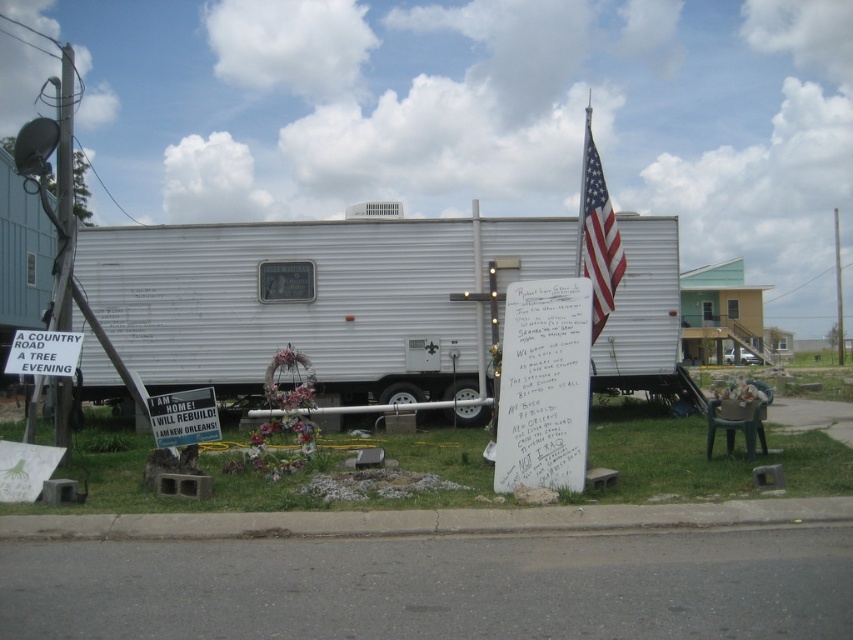
Is the position of white paper at center more distant than that of american flag at center?

No, white paper at center is closer to the viewer.

Between white paper at center and american flag at center, which one appears on the left side from the viewer's perspective?

white paper at center is more to the left.

Is point (576, 380) positioned in front of point (576, 244)?

Yes.

Find the location of `white paper at center`. white paper at center is located at coordinates (543, 385).

Who is shorter, white corrugated metal trailer at center or white paper sign at lower left?

With less height is white paper sign at lower left.

Does white corrugated metal trailer at center appear on the left side of white paper sign at lower left?

No, white corrugated metal trailer at center is not to the left of white paper sign at lower left.

Locate an element on the screen. This screenshot has width=853, height=640. white corrugated metal trailer at center is located at coordinates (x=315, y=300).

Identify the location of white corrugated metal trailer at center. (315, 300).

Between white paper at center and metallic silver sign at lower center, which one is positioned lower?

metallic silver sign at lower center is below.

Can you confirm if white paper at center is positioned to the right of metallic silver sign at lower center?

Yes, white paper at center is to the right of metallic silver sign at lower center.

Describe the element at coordinates (543, 385) in the screenshot. I see `white paper at center` at that location.

Find the location of a particular element. This screenshot has width=853, height=640. white paper at center is located at coordinates (543, 385).